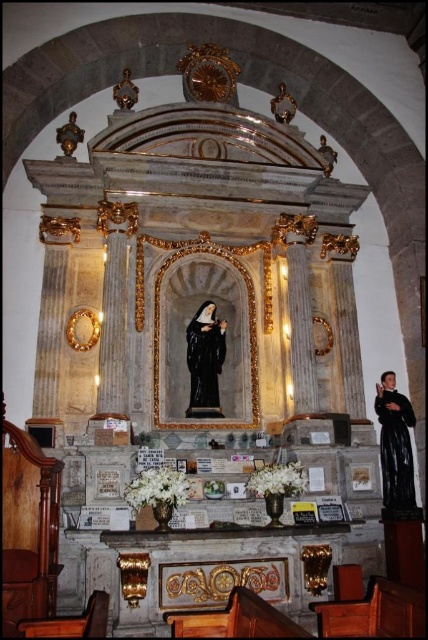
You are an art conservator assessing the space between the black matte robe at right and the black glossy statue at center. Which object is bigger in size?

The black matte robe at right has a larger size compared to the black glossy statue at center, so the black matte robe at right is bigger.

You are standing in the cathedral and want to approach the black matte robe at right. Considering the distance, will you need to walk more than 100 feet to reach it?

The black matte robe at right is 139.81 feet away from the viewer, so yes, you will need to walk more than 100 feet to reach it.

You are an art student analyzing the altar scene. You notice the black matte robe at right and the black glossy statue at center. Which object has a greater height in this composition?

The black matte robe at right is taller than the black glossy statue at center.